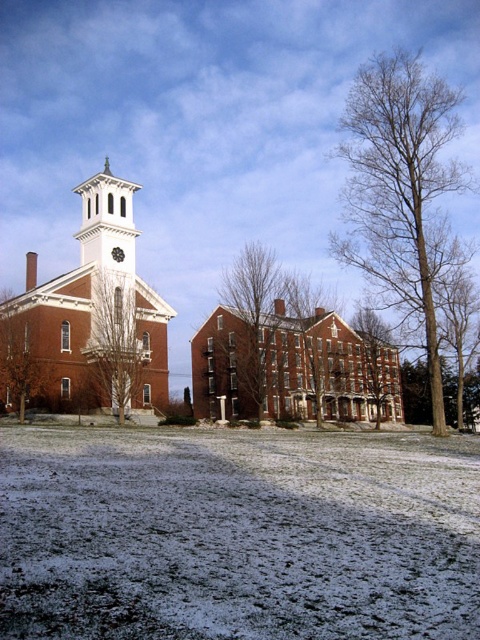
Can you confirm if snowy grass at center is shorter than bare wood tree at center?

Yes, snowy grass at center is shorter than bare wood tree at center.

Which is more to the left, snowy grass at center or bare wood tree at center?

snowy grass at center

Where is `snowy grass at center`? The width and height of the screenshot is (480, 640). snowy grass at center is located at coordinates (238, 532).

Is brick building at center to the right of brown textured tree at left from the viewer's perspective?

Correct, you'll find brick building at center to the right of brown textured tree at left.

Does brick building at center have a greater height compared to brown textured tree at left?

Indeed, brick building at center has a greater height compared to brown textured tree at left.

In order to click on brick building at center in this screenshot , I will do `click(291, 369)`.

Where is `brick building at center`? The height and width of the screenshot is (640, 480). brick building at center is located at coordinates (291, 369).

The width and height of the screenshot is (480, 640). What do you see at coordinates (402, 192) in the screenshot?
I see `bare wood tree at right` at bounding box center [402, 192].

Can you confirm if bare wood tree at right is shorter than bare wood tree at center?

No.

Does point (370, 176) lie in front of point (354, 328)?

Yes, it is in front of point (354, 328).

I want to click on bare wood tree at right, so click(402, 192).